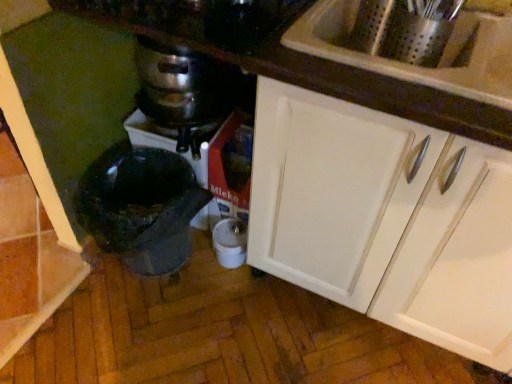
Question: Considering the relative sizes of stainless steel pot at center and white glossy cabinet at upper right in the image provided, is stainless steel pot at center bigger than white glossy cabinet at upper right?

Choices:
 (A) yes
 (B) no

Answer: (B)

Question: Is stainless steel pot at center facing away from white glossy cabinet at upper right?

Choices:
 (A) yes
 (B) no

Answer: (B)

Question: Could white glossy cabinet at upper right be considered to be inside stainless steel pot at center?

Choices:
 (A) yes
 (B) no

Answer: (B)

Question: Considering the relative positions of stainless steel pot at center and white glossy cabinet at upper right in the image provided, is stainless steel pot at center to the left of white glossy cabinet at upper right from the viewer's perspective?

Choices:
 (A) no
 (B) yes

Answer: (B)

Question: Does stainless steel pot at center have a smaller size compared to white glossy cabinet at upper right?

Choices:
 (A) no
 (B) yes

Answer: (B)

Question: Is stainless steel pot at center positioned behind white glossy cabinet at upper right?

Choices:
 (A) no
 (B) yes

Answer: (B)

Question: From the image's perspective, would you say white plastic container at lower center, the first appliance in the right-to-left sequence, is positioned over white glossy sink at upper right?

Choices:
 (A) no
 (B) yes

Answer: (A)

Question: Can we say white plastic container at lower center, marked as the 2th appliance in a left-to-right arrangement, lies outside white glossy sink at upper right?

Choices:
 (A) no
 (B) yes

Answer: (B)

Question: Is white plastic container at lower center, the first appliance in the right-to-left sequence, oriented towards white glossy sink at upper right?

Choices:
 (A) yes
 (B) no

Answer: (B)

Question: Is white plastic container at lower center, the first appliance in the right-to-left sequence, beside white glossy sink at upper right?

Choices:
 (A) yes
 (B) no

Answer: (B)

Question: From a real-world perspective, is white plastic container at lower center, marked as the 2th appliance in a left-to-right arrangement, on top of white glossy sink at upper right?

Choices:
 (A) yes
 (B) no

Answer: (B)

Question: Considering the relative sizes of white plastic container at lower center, the first appliance in the right-to-left sequence, and white glossy sink at upper right in the image provided, is white plastic container at lower center, the first appliance in the right-to-left sequence, bigger than white glossy sink at upper right?

Choices:
 (A) yes
 (B) no

Answer: (B)

Question: From a real-world perspective, is white glossy cabinet at upper right beneath white plastic container at lower center, the first appliance in the right-to-left sequence?

Choices:
 (A) yes
 (B) no

Answer: (B)